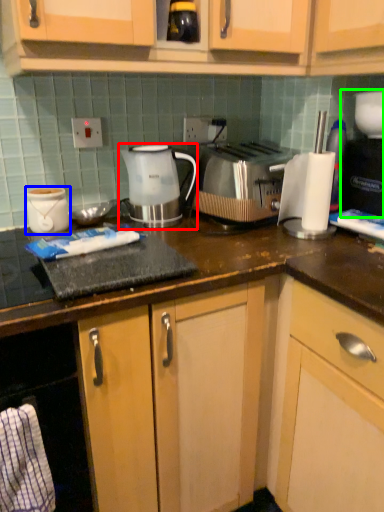
Question: Estimate the real-world distances between objects in this image. Which object is closer to kettle (highlighted by a red box), appliance (highlighted by a blue box) or coffee machine (highlighted by a green box)?

Choices:
 (A) appliance
 (B) coffee machine

Answer: (A)